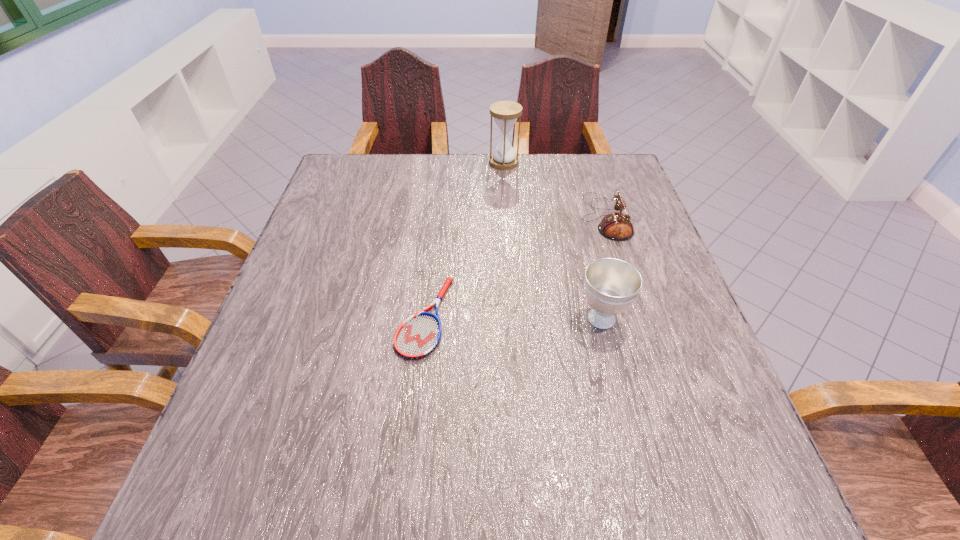
I want to click on hourglass, so click(505, 113).

Locate an element on the screen. the tallest object is located at coordinates (505, 113).

The width and height of the screenshot is (960, 540). I want to click on chalice, so click(611, 285).

I want to click on telephone, so [x=616, y=226].

The width and height of the screenshot is (960, 540). What are the coordinates of `the second shortest object` in the screenshot? It's located at (616, 226).

The height and width of the screenshot is (540, 960). I want to click on tennis racket, so click(x=418, y=336).

The width and height of the screenshot is (960, 540). In order to click on the leftmost object in this screenshot , I will do `click(418, 336)`.

Where is `free space located on the left of the third object from right to left`? free space located on the left of the third object from right to left is located at coordinates (413, 163).

The width and height of the screenshot is (960, 540). I want to click on free space located 0.400m on the left of the chalice, so click(x=388, y=319).

Identify the location of vacant space located 0.330m on the rotary dial of the telephone. (459, 218).